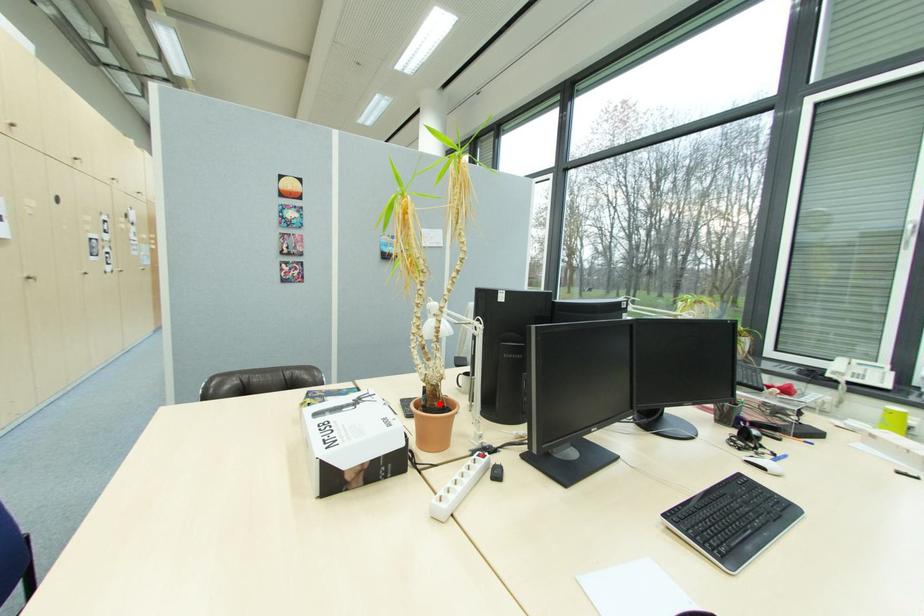
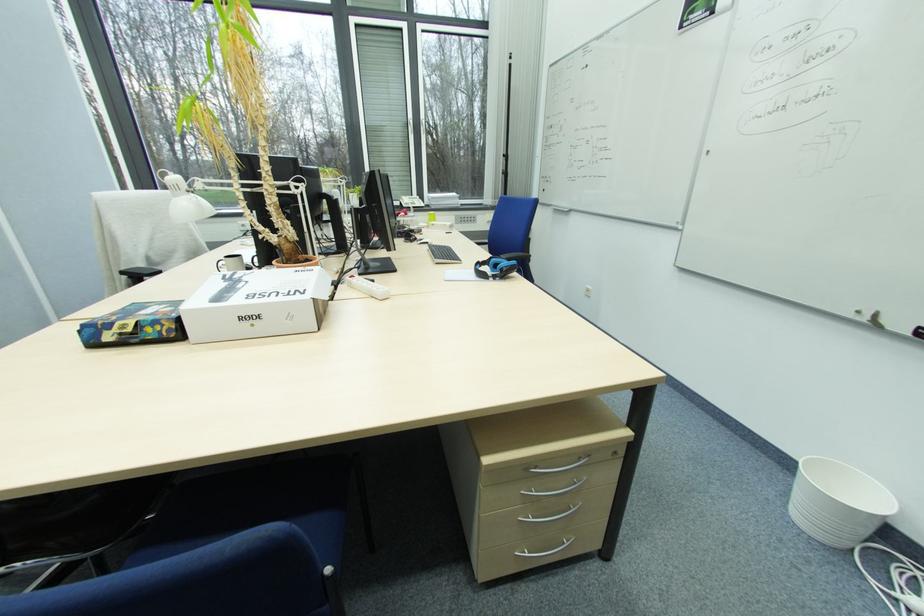
Question: A red point is marked in image1. In image2, is the corresponding 3D point closer to the camera or farther? Reply with the corresponding letter.

Choices:
 (A) The corresponding 3D point is closer.
 (B) The corresponding 3D point is farther.

Answer: (A)